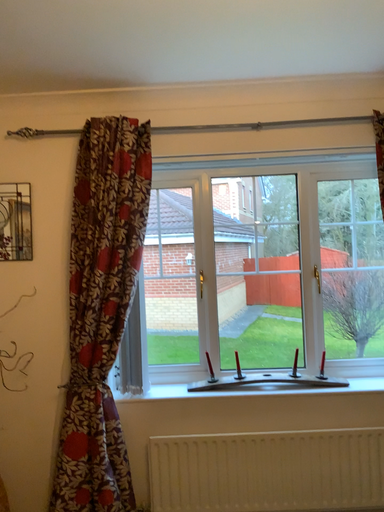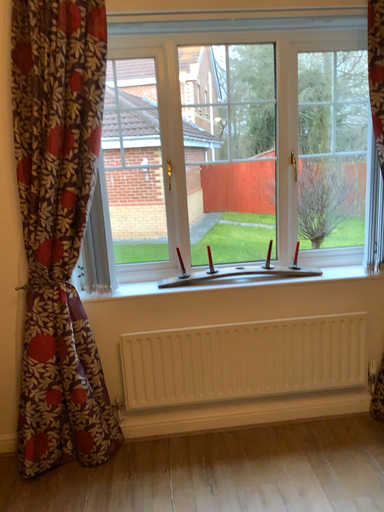
Question: Which way did the camera rotate in the video?

Choices:
 (A) rotated left
 (B) rotated right

Answer: (B)